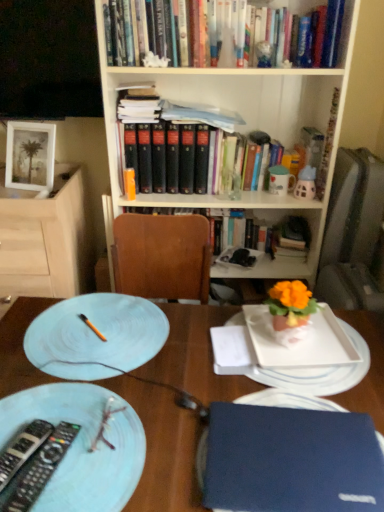
Question: Would you say blue glossy plate at lower left, which is counted as the 1th plate, starting from the front, contains white glossy platter at center?

Choices:
 (A) no
 (B) yes

Answer: (A)

Question: Is blue glossy plate at lower left, which is the 2th plate in top-to-bottom order, shorter than white glossy platter at center?

Choices:
 (A) yes
 (B) no

Answer: (A)

Question: From the image's perspective, is blue glossy plate at lower left, which is counted as the 1th plate, starting from the front, beneath white glossy platter at center?

Choices:
 (A) no
 (B) yes

Answer: (B)

Question: Does blue glossy plate at lower left, which is the 2th plate in top-to-bottom order, appear on the left side of white glossy platter at center?

Choices:
 (A) yes
 (B) no

Answer: (A)

Question: From the image's perspective, is blue glossy plate at lower left, which is the 2th plate in top-to-bottom order, above white glossy platter at center?

Choices:
 (A) yes
 (B) no

Answer: (B)

Question: Is blue glossy plate at lower left, positioned as the second plate in back-to-front order, in front of white glossy platter at center?

Choices:
 (A) no
 (B) yes

Answer: (B)

Question: Is white matte picture frame at upper left outside blue glossy plate at lower left, positioned as the second plate in back-to-front order?

Choices:
 (A) no
 (B) yes

Answer: (B)

Question: Is white matte picture frame at upper left bigger than blue glossy plate at lower left, positioned as the second plate in back-to-front order?

Choices:
 (A) no
 (B) yes

Answer: (B)

Question: Is white matte picture frame at upper left shorter than blue glossy plate at lower left, positioned as the second plate in back-to-front order?

Choices:
 (A) yes
 (B) no

Answer: (B)

Question: Is blue glossy plate at lower left, positioned as the second plate in back-to-front order, completely or partially inside white matte picture frame at upper left?

Choices:
 (A) yes
 (B) no

Answer: (B)

Question: Is white matte picture frame at upper left to the right of blue glossy plate at lower left, arranged as the 1th plate when ordered from the bottom, from the viewer's perspective?

Choices:
 (A) yes
 (B) no

Answer: (B)

Question: Does white matte picture frame at upper left have a greater height compared to blue glossy plate at lower left, positioned as the second plate in back-to-front order?

Choices:
 (A) yes
 (B) no

Answer: (A)

Question: Considering the relative positions of matte white plate at left and blue matte laptop at lower right in the image provided, is matte white plate at left to the left of blue matte laptop at lower right from the viewer's perspective?

Choices:
 (A) no
 (B) yes

Answer: (B)